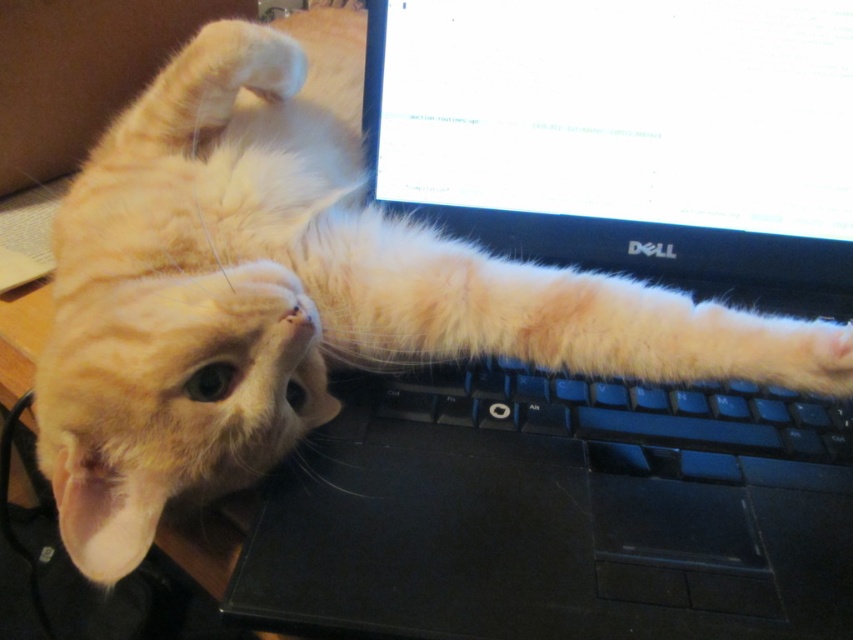
You are a robotic cat toy trying to reach the keyboard. The keyboard is at the center of the image. You are currently at point [622,410]. Can you reach the keyboard from your current position?

The point [622,410] corresponds to the black plastic keyboard at center, so yes, you are already at the keyboard.

You are a photographer trying to capture a closeup of the point at coordinates point (x=770, y=113) in the scene. What is the minimum distance you need to move your camera forward to focus on this point?

The point at coordinates point (x=770, y=113) is 68.63 centimeters away from the camera. To focus on this point, the camera needs to be positioned at least 68.63 centimeters away from the point.